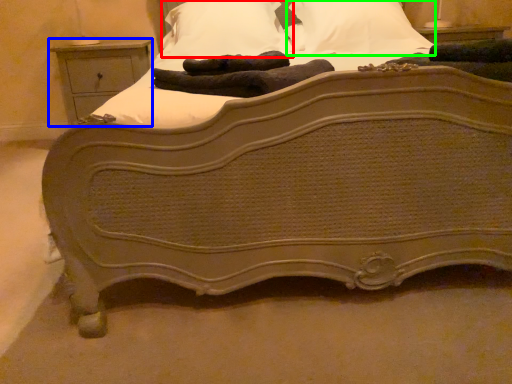
Question: Which object is positioned closest to pillow (highlighted by a red box)? Select from nightstand (highlighted by a blue box) and pillow (highlighted by a green box).

Choices:
 (A) nightstand
 (B) pillow

Answer: (B)